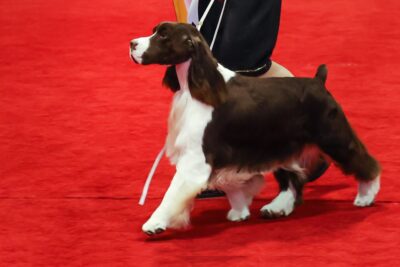
Find the location of a particular element. The height and width of the screenshot is (267, 400). red carpet is located at coordinates (106, 88).